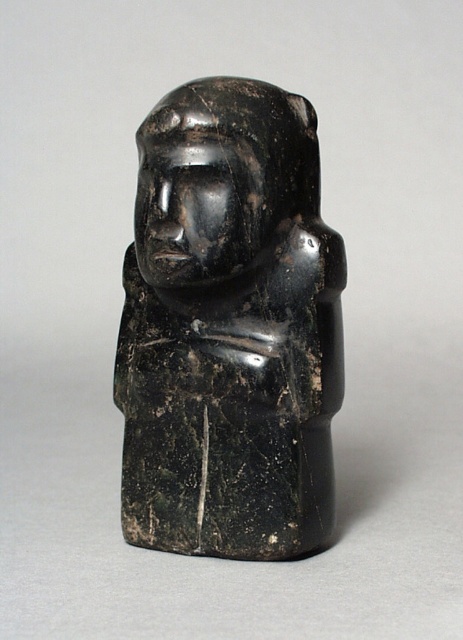
Question: Does black stone figure at center have a lesser width compared to black stone head at center?

Choices:
 (A) no
 (B) yes

Answer: (A)

Question: Can you confirm if black stone figure at center is smaller than black stone head at center?

Choices:
 (A) yes
 (B) no

Answer: (B)

Question: Does black stone figure at center have a lesser width compared to black stone head at center?

Choices:
 (A) yes
 (B) no

Answer: (B)

Question: Among these points, which one is farthest from the camera?

Choices:
 (A) (299, 176)
 (B) (144, 452)

Answer: (B)